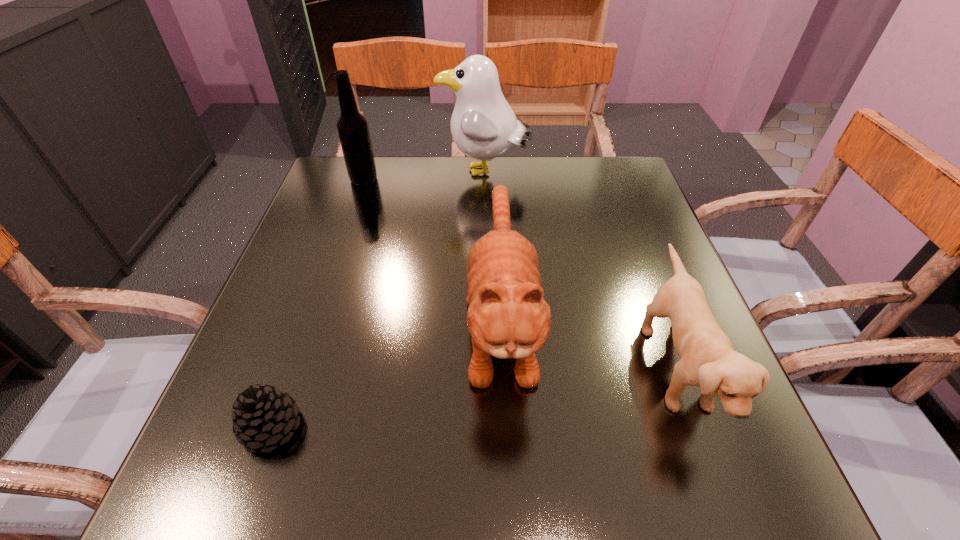
This screenshot has width=960, height=540. Identify the location of gull. (483, 125).

The height and width of the screenshot is (540, 960). Identify the location of beer bottle. (353, 130).

Where is `cat`? Image resolution: width=960 pixels, height=540 pixels. cat is located at coordinates (507, 317).

This screenshot has width=960, height=540. I want to click on puppy, so coord(708,359).

This screenshot has width=960, height=540. In order to click on the rightmost object in this screenshot , I will do `click(708, 359)`.

What are the coordinates of `the shortest object` in the screenshot? It's located at (264, 415).

This screenshot has width=960, height=540. In order to click on free point located 0.130m on the beak of the gull in this screenshot , I will do `click(393, 173)`.

Identify the location of vacant space located 0.190m on the beak of the gull. The width and height of the screenshot is (960, 540). (371, 173).

What are the coordinates of `vacant space situated on the beak of the gull` in the screenshot? It's located at (381, 173).

Locate an element on the screen. This screenshot has width=960, height=540. free space located on the front of the beer bottle is located at coordinates (332, 273).